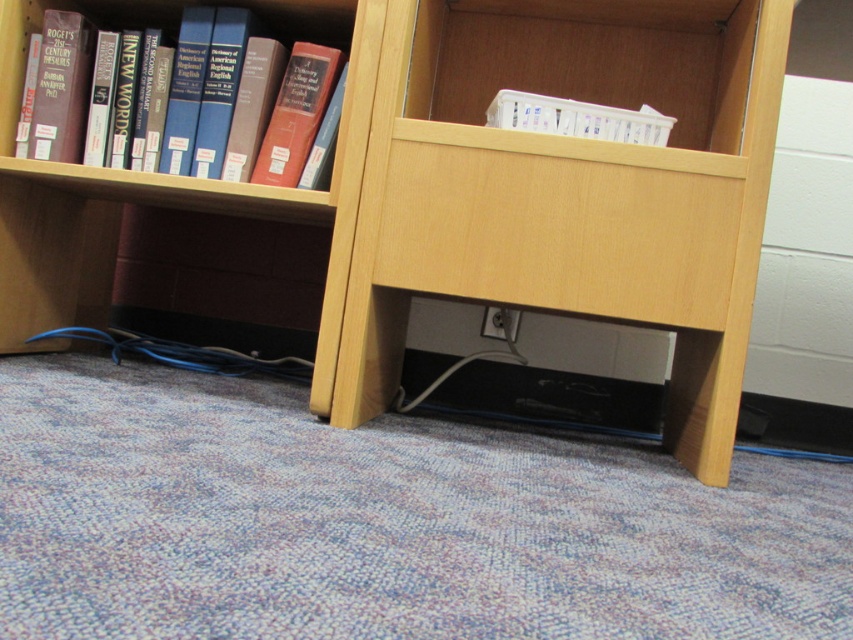
Question: Which point is closer to the camera?

Choices:
 (A) matte red book at center
 (B) hardcover book at left

Answer: (A)

Question: Does matte red book at upper center appear under hardcover book at center?

Choices:
 (A) no
 (B) yes

Answer: (A)

Question: Can you confirm if white plastic container at upper center is smaller than matte red book at upper center?

Choices:
 (A) no
 (B) yes

Answer: (A)

Question: Which point is closer to the camera?

Choices:
 (A) hardcover book at left
 (B) matte red book at center
 (C) wooden bookshelf at lower center

Answer: (C)

Question: Which point is closer to the camera?

Choices:
 (A) (502, 140)
 (B) (337, 88)

Answer: (A)

Question: Can you confirm if light wood drawer at center is smaller than white plastic container at upper center?

Choices:
 (A) no
 (B) yes

Answer: (A)